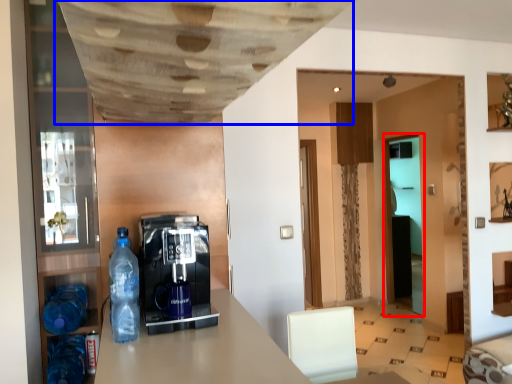
Question: Which point is further to the camera, glass door (highlighted by a red box) or exhaust hood (highlighted by a blue box)?

Choices:
 (A) glass door
 (B) exhaust hood

Answer: (A)